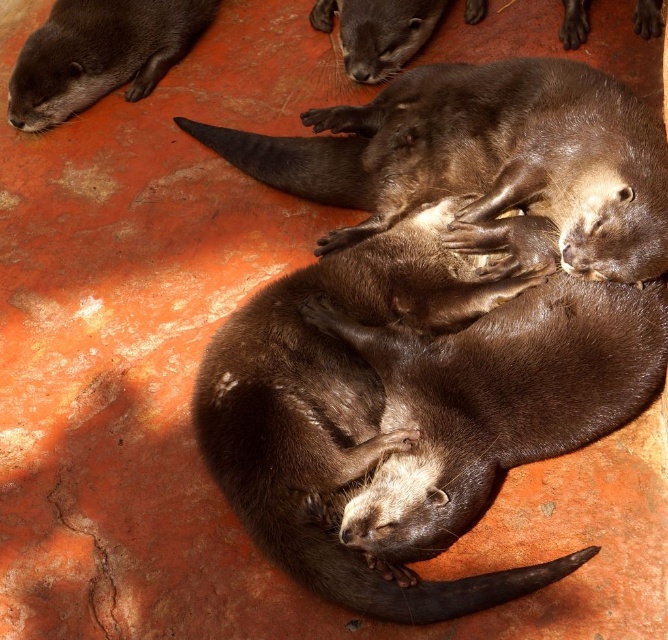
Is shiny brown otter at center smaller than shiny brown otter at upper left?

No, shiny brown otter at center is not smaller than shiny brown otter at upper left.

Is shiny brown otter at center positioned before shiny brown otter at upper left?

Yes, shiny brown otter at center is closer to the viewer.

Which is in front, point (476, 182) or point (156, 68)?

Point (476, 182)

What are the coordinates of `shiny brown otter at center` in the screenshot? It's located at (484, 157).

Is point (222, 372) positioned after point (528, 292)?

No.

Who is more forward, [339,385] or [462,417]?

Point [462,417] is more forward.

I want to click on brown shiny otter at center, so click(339, 412).

Is brown shiny otter at center to the right of shiny brown otter at upper left from the viewer's perspective?

Correct, you'll find brown shiny otter at center to the right of shiny brown otter at upper left.

Is brown shiny otter at center closer to the viewer compared to shiny brown otter at upper left?

Yes, it is.

Locate an element on the screen. brown shiny otter at center is located at coordinates (339, 412).

The image size is (668, 640). I want to click on brown shiny otter at center, so click(339, 412).